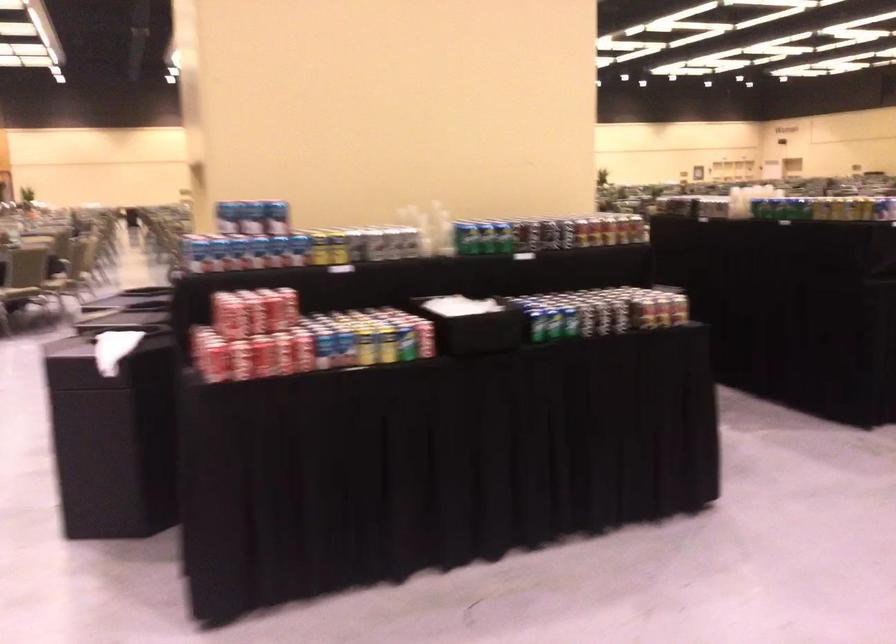
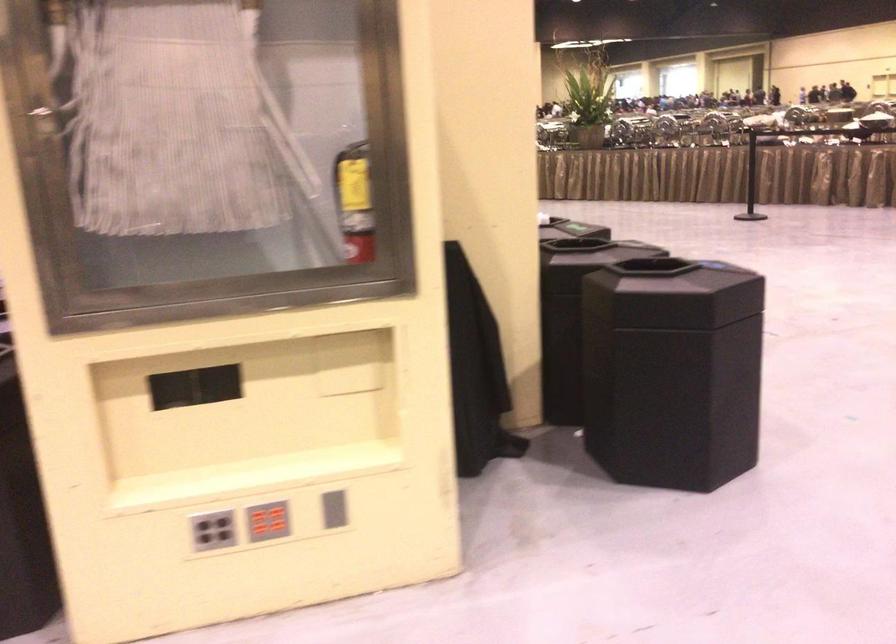
Question: I am providing you with two images of the same scene from different viewpoints. After the viewpoint changes to image2, which objects are now occluded?

Choices:
 (A) plastic bottle
 (B) red button panel
 (C) grey button panel
 (D) green soda can

Answer: (D)